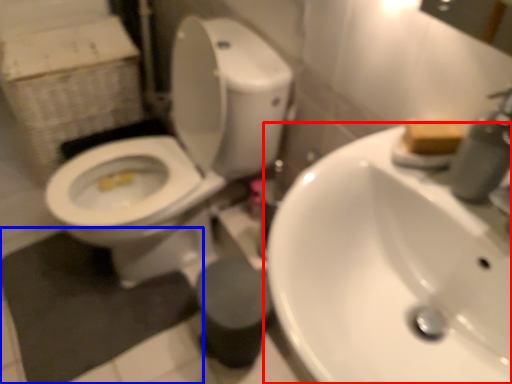
Question: Which point is closer to the camera, sink (highlighted by a red box) or bath mat (highlighted by a blue box)?

Choices:
 (A) sink
 (B) bath mat

Answer: (A)